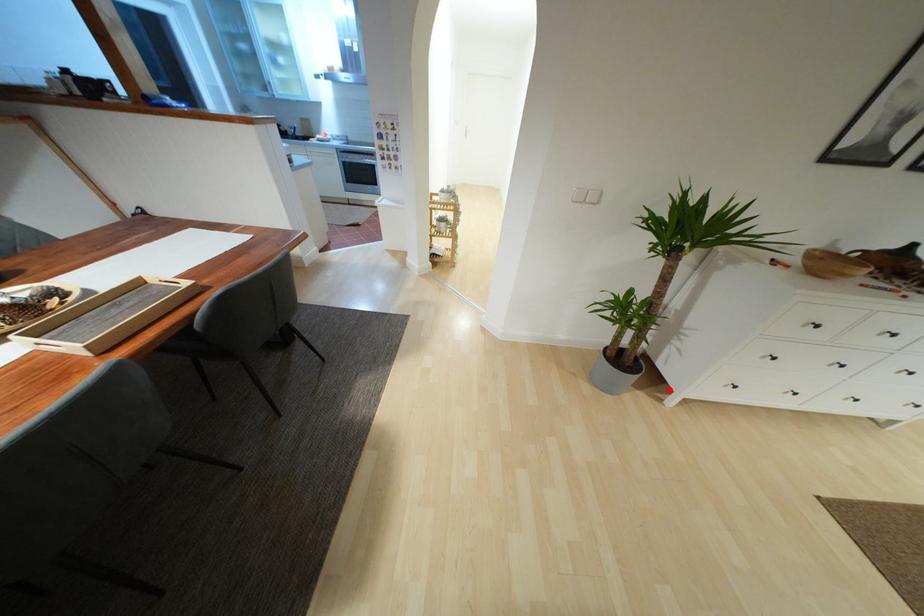
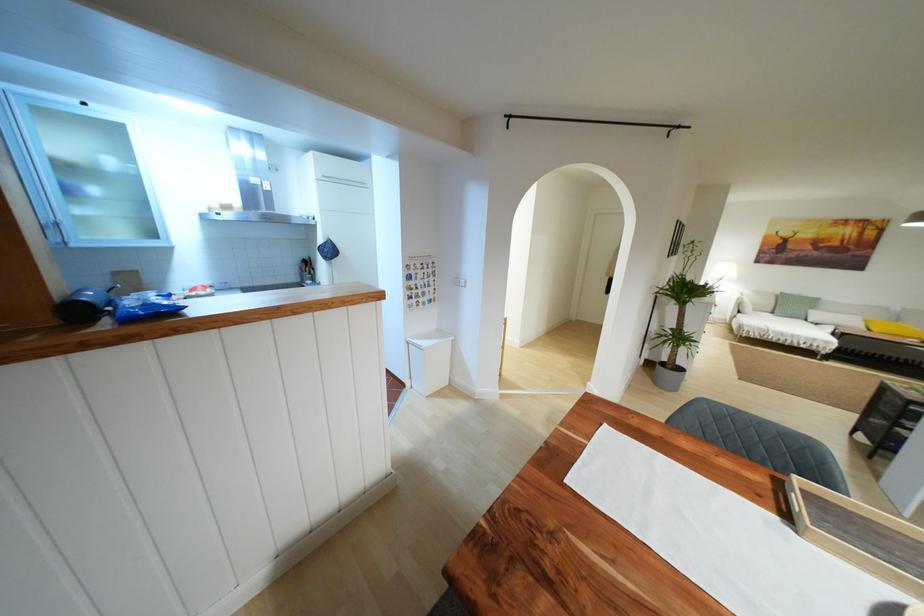
Find the pixel in the second image that matches the highlighted location in the first image.

(681, 370)